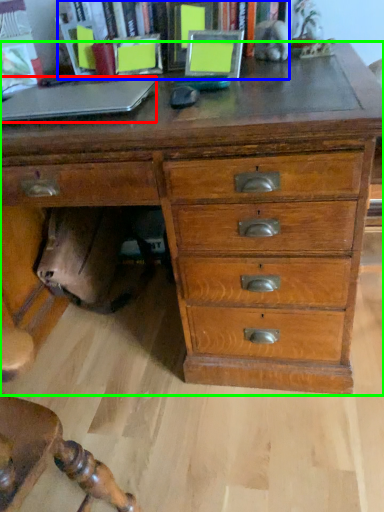
Question: Estimate the real-world distances between objects in this image. Which object is farther from laptop (highlighted by a red box), bookcase (highlighted by a blue box) or chest of drawers (highlighted by a green box)?

Choices:
 (A) bookcase
 (B) chest of drawers

Answer: (A)